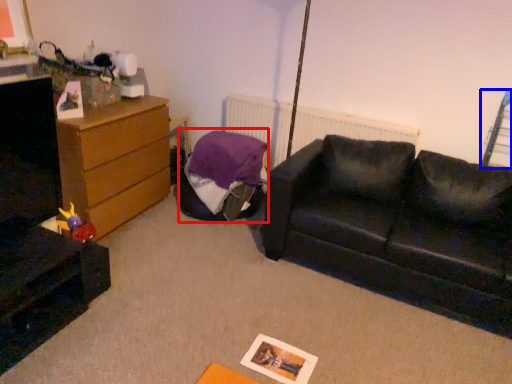
Question: Among these objects, which one is nearest to the camera, bean bag chair (highlighted by a red box) or swivel chair (highlighted by a blue box)?

Choices:
 (A) bean bag chair
 (B) swivel chair

Answer: (B)